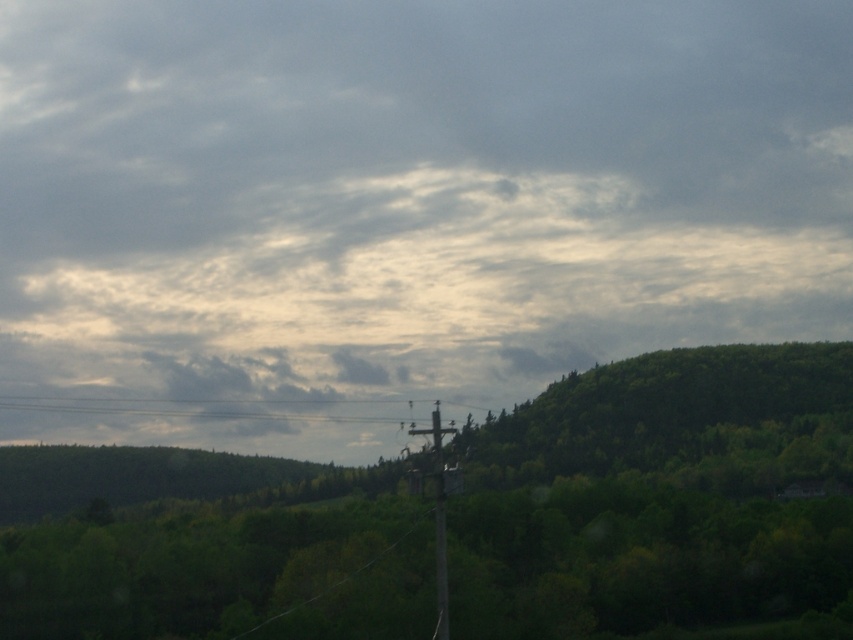
Identify the location of cloudy sky at upper center. The height and width of the screenshot is (640, 853). (399, 204).

Can you confirm if cloudy sky at upper center is positioned to the left of green leafy tree at center?

Incorrect, cloudy sky at upper center is not on the left side of green leafy tree at center.

The height and width of the screenshot is (640, 853). What are the coordinates of `cloudy sky at upper center` in the screenshot? It's located at (399, 204).

Can you confirm if black wire at center is shorter than brown wooden telegraph pole at center?

Yes, black wire at center is shorter than brown wooden telegraph pole at center.

Is black wire at center wider than brown wooden telegraph pole at center?

Yes.

Which is in front, point (42, 410) or point (438, 406)?

Positioned in front is point (438, 406).

Identify the location of black wire at center. The width and height of the screenshot is (853, 640). click(213, 406).

Who is higher up, green leafy tree at center or black wire at center?

green leafy tree at center is higher up.

Is green leafy tree at center bigger than black wire at center?

Indeed, green leafy tree at center has a larger size compared to black wire at center.

The width and height of the screenshot is (853, 640). Describe the element at coordinates (660, 499) in the screenshot. I see `green leafy tree at center` at that location.

Locate an element on the screen. Image resolution: width=853 pixels, height=640 pixels. green leafy tree at center is located at coordinates (660, 499).